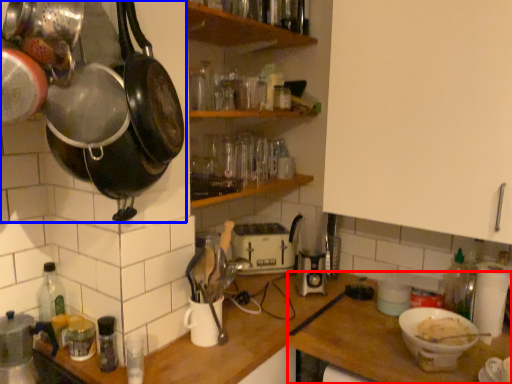
Question: Among these objects, which one is nearest to the camera, table (highlighted by a red box) or frying pan (highlighted by a blue box)?

Choices:
 (A) table
 (B) frying pan

Answer: (B)